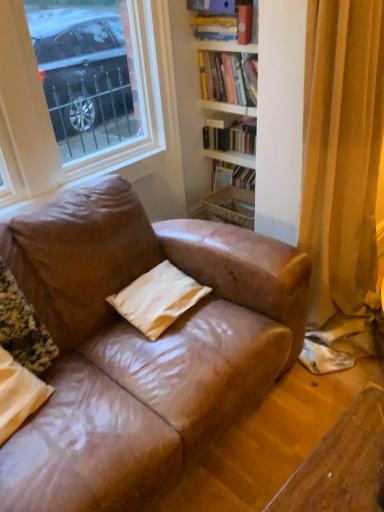
You are a GUI agent. You are given a task and a screenshot of the screen. Output one action in this format:
    pyautogui.click(x=<x>, y=<y>)
    Task: Click on the matte hardcover book at upper right, which appears as the 1th book when viewed from the top
    Image resolution: width=384 pixels, height=512 pixels.
    Given the screenshot: What is the action you would take?
    pyautogui.click(x=223, y=20)

Measure the distance between white matte pillow at center, the first pillow from the right, and camera.

white matte pillow at center, the first pillow from the right, is 1.57 meters from camera.

Where is `matte beige pillow at lower left, the first pillow when ordered from left to right`? The height and width of the screenshot is (512, 384). matte beige pillow at lower left, the first pillow when ordered from left to right is located at coordinates (23, 327).

Between point (247, 97) and point (14, 352), which one is positioned in front?

The point (14, 352) is closer.

Identify the location of the 1st pillow located beneath the hardcover books at upper center, placed as the 2th book when sorted from top to bottom (from a real-world perspective). The height and width of the screenshot is (512, 384). (23, 327).

How different are the orientations of hardcover books at upper center, placed as the 2th book when sorted from top to bottom, and matte beige pillow at lower left, the second pillow from the right, in degrees?

The angle between the facing direction of hardcover books at upper center, placed as the 2th book when sorted from top to bottom, and the facing direction of matte beige pillow at lower left, the second pillow from the right, is 89.6 degrees.

Is hardcover books at upper center, positioned as the 2th book in bottom-to-top order, bigger than matte beige pillow at lower left, the first pillow when ordered from left to right?

Incorrect, hardcover books at upper center, positioned as the 2th book in bottom-to-top order, is not larger than matte beige pillow at lower left, the first pillow when ordered from left to right.

Is matte beige pillow at lower left, the first pillow when ordered from left to right, thinner than hardcover books at upper center, placed as the 2th book when sorted from top to bottom?

No.

Considering the relative positions of matte beige pillow at lower left, the second pillow from the right, and hardcover books at upper center, positioned as the 2th book in bottom-to-top order, in the image provided, is matte beige pillow at lower left, the second pillow from the right, to the right of hardcover books at upper center, positioned as the 2th book in bottom-to-top order, from the viewer's perspective?

In fact, matte beige pillow at lower left, the second pillow from the right, is to the left of hardcover books at upper center, positioned as the 2th book in bottom-to-top order.

Which is behind, point (2, 326) or point (243, 81)?

Positioned behind is point (243, 81).

From the image's perspective, between matte beige pillow at lower left, the second pillow from the right, and hardcover books at upper center, positioned as the 2th book in bottom-to-top order, which one is located above?

hardcover books at upper center, positioned as the 2th book in bottom-to-top order, is shown above in the image.

Between hardcover books at upper center, positioned as the 2th book in bottom-to-top order, and matte hardcover book at upper right, the third book positioned from the bottom, which one is positioned behind?

hardcover books at upper center, positioned as the 2th book in bottom-to-top order, is more distant.

Considering the sizes of hardcover books at upper center, positioned as the 2th book in bottom-to-top order, and matte hardcover book at upper right, the third book positioned from the bottom, in the image, is hardcover books at upper center, positioned as the 2th book in bottom-to-top order, bigger or smaller than matte hardcover book at upper right, the third book positioned from the bottom,?

In the image, hardcover books at upper center, positioned as the 2th book in bottom-to-top order, appears to be larger than matte hardcover book at upper right, the third book positioned from the bottom.

Is hardcover books at upper center, placed as the 2th book when sorted from top to bottom, wider or thinner than matte hardcover book at upper right, which appears as the 1th book when viewed from the top?

hardcover books at upper center, placed as the 2th book when sorted from top to bottom, is thinner than matte hardcover book at upper right, which appears as the 1th book when viewed from the top.

Could you measure the distance between hardcover books at upper center, placed as the 2th book when sorted from top to bottom, and matte hardcover book at upper right, which appears as the 1th book when viewed from the top?

A distance of 6.89 inches exists between hardcover books at upper center, placed as the 2th book when sorted from top to bottom, and matte hardcover book at upper right, which appears as the 1th book when viewed from the top.

What's the angular difference between hardcover books at upper center, placed as the 2th book when sorted from top to bottom, and white matte bookshelf at upper center, acting as the 3th book starting from the top,'s facing directions?

hardcover books at upper center, placed as the 2th book when sorted from top to bottom, and white matte bookshelf at upper center, acting as the 3th book starting from the top, are facing 0.314 degrees away from each other.

Consider the image. From a real-world perspective, which object stands above the other?

hardcover books at upper center, placed as the 2th book when sorted from top to bottom.

From the picture: Is hardcover books at upper center, positioned as the 2th book in bottom-to-top order, in front of or behind white matte bookshelf at upper center, acting as the 3th book starting from the top, in the image?

Visually, hardcover books at upper center, positioned as the 2th book in bottom-to-top order, is located in front of white matte bookshelf at upper center, acting as the 3th book starting from the top.

Is hardcover books at upper center, positioned as the 2th book in bottom-to-top order, touching white matte bookshelf at upper center, which is counted as the first book, starting from the bottom?

No, hardcover books at upper center, positioned as the 2th book in bottom-to-top order, is not next to white matte bookshelf at upper center, which is counted as the first book, starting from the bottom.

Consider the image. Does white matte pillow at center, the 2th pillow from the left, lie behind matte hardcover book at upper right, the third book positioned from the bottom?

No.

From a real-world perspective, who is located higher, white matte pillow at center, the 2th pillow from the left, or matte hardcover book at upper right, which appears as the 1th book when viewed from the top?

matte hardcover book at upper right, which appears as the 1th book when viewed from the top, is physically above.

Which of these two, white matte pillow at center, the first pillow from the right, or matte hardcover book at upper right, which appears as the 1th book when viewed from the top, is bigger?

matte hardcover book at upper right, which appears as the 1th book when viewed from the top, is bigger.

Considering the relative sizes of matte hardcover book at upper right, which appears as the 1th book when viewed from the top, and matte beige pillow at lower left, the second pillow from the right, in the image provided, is matte hardcover book at upper right, which appears as the 1th book when viewed from the top, taller than matte beige pillow at lower left, the second pillow from the right,?

In fact, matte hardcover book at upper right, which appears as the 1th book when viewed from the top, may be shorter than matte beige pillow at lower left, the second pillow from the right.

How distant is matte hardcover book at upper right, the third book positioned from the bottom, from matte beige pillow at lower left, the first pillow when ordered from left to right?

A distance of 5.47 feet exists between matte hardcover book at upper right, the third book positioned from the bottom, and matte beige pillow at lower left, the first pillow when ordered from left to right.

From a real-world perspective, is matte hardcover book at upper right, the third book positioned from the bottom, positioned over matte beige pillow at lower left, the second pillow from the right, based on gravity?

Correct, in the physical world, matte hardcover book at upper right, the third book positioned from the bottom, is higher than matte beige pillow at lower left, the second pillow from the right.

Considering the relative positions of matte hardcover book at upper right, the third book positioned from the bottom, and matte beige pillow at lower left, the first pillow when ordered from left to right, in the image provided, is matte hardcover book at upper right, the third book positioned from the bottom, in front of matte beige pillow at lower left, the first pillow when ordered from left to right,?

No, it is not.

Between point (246, 121) and point (180, 310), which one is positioned behind?

The point (246, 121) is behind.

The image size is (384, 512). I want to click on the 1st pillow in front when counting from the white matte bookshelf at upper center, acting as the 3th book starting from the top, so click(x=157, y=298).

Is white matte bookshelf at upper center, which is counted as the first book, starting from the bottom, touching white matte pillow at center, the 2th pillow from the left?

There is a gap between white matte bookshelf at upper center, which is counted as the first book, starting from the bottom, and white matte pillow at center, the 2th pillow from the left.

From the image's perspective, between white matte bookshelf at upper center, acting as the 3th book starting from the top, and white matte pillow at center, the first pillow from the right, which one is located above?

white matte bookshelf at upper center, acting as the 3th book starting from the top.

This screenshot has height=512, width=384. Identify the location of book that is the 2nd one when counting upward from the matte beige pillow at lower left, the first pillow when ordered from left to right (from the image's perspective). (228, 77).

Starting from the hardcover books at upper center, positioned as the 2th book in bottom-to-top order, which pillow is the 2nd one to the left? Please provide its 2D coordinates.

[(23, 327)]

Considering their positions, is white matte bookshelf at upper center, acting as the 3th book starting from the top, positioned further to matte hardcover book at upper right, which appears as the 1th book when viewed from the top, than hardcover books at upper center, positioned as the 2th book in bottom-to-top order?

Among the two, white matte bookshelf at upper center, acting as the 3th book starting from the top, is located further to matte hardcover book at upper right, which appears as the 1th book when viewed from the top.

From the image, which object appears to be nearer to white matte pillow at center, the 2th pillow from the left, matte hardcover book at upper right, which appears as the 1th book when viewed from the top, or hardcover books at upper center, positioned as the 2th book in bottom-to-top order?

Among the two, hardcover books at upper center, positioned as the 2th book in bottom-to-top order, is located nearer to white matte pillow at center, the 2th pillow from the left.

Looking at the image, which one is located further to white matte bookshelf at upper center, which is counted as the first book, starting from the bottom, matte hardcover book at upper right, the third book positioned from the bottom, or white matte pillow at center, the 2th pillow from the left?

white matte pillow at center, the 2th pillow from the left.

Looking at the image, which one is located closer to hardcover books at upper center, placed as the 2th book when sorted from top to bottom, matte beige pillow at lower left, the first pillow when ordered from left to right, or white matte bookshelf at upper center, acting as the 3th book starting from the top?

The object closer to hardcover books at upper center, placed as the 2th book when sorted from top to bottom, is white matte bookshelf at upper center, acting as the 3th book starting from the top.

Estimate the real-world distances between objects in this image. Which object is further from matte beige pillow at lower left, the second pillow from the right, white matte pillow at center, the 2th pillow from the left, or white matte bookshelf at upper center, which is counted as the first book, starting from the bottom?

Among the two, white matte bookshelf at upper center, which is counted as the first book, starting from the bottom, is located further to matte beige pillow at lower left, the second pillow from the right.

Estimate the real-world distances between objects in this image. Which object is closer to matte beige pillow at lower left, the first pillow when ordered from left to right, white matte pillow at center, the first pillow from the right, or matte hardcover book at upper right, the third book positioned from the bottom?

The object closer to matte beige pillow at lower left, the first pillow when ordered from left to right, is white matte pillow at center, the first pillow from the right.

Considering their positions, is white matte pillow at center, the first pillow from the right, positioned closer to hardcover books at upper center, positioned as the 2th book in bottom-to-top order, than matte beige pillow at lower left, the first pillow when ordered from left to right?

white matte pillow at center, the first pillow from the right.

Considering their positions, is matte beige pillow at lower left, the second pillow from the right, positioned further to white matte pillow at center, the first pillow from the right, than matte hardcover book at upper right, which appears as the 1th book when viewed from the top?

Based on the image, matte hardcover book at upper right, which appears as the 1th book when viewed from the top, appears to be further to white matte pillow at center, the first pillow from the right.

Locate an element on the screen. The image size is (384, 512). book between hardcover books at upper center, placed as the 2th book when sorted from top to bottom, and white matte pillow at center, the 2th pillow from the left, vertically is located at coordinates (232, 137).

Identify the location of pillow between matte hardcover book at upper right, which appears as the 1th book when viewed from the top, and matte beige pillow at lower left, the first pillow when ordered from left to right, in the vertical direction. Image resolution: width=384 pixels, height=512 pixels. (157, 298).

You are a GUI agent. You are given a task and a screenshot of the screen. Output one action in this format:
    pyautogui.click(x=<x>, y=<y>)
    Task: Click on the pillow between hardcover books at upper center, placed as the 2th book when sorted from top to bottom, and matte beige pillow at lower left, the first pillow when ordered from left to right, vertically
    
    Given the screenshot: What is the action you would take?
    pyautogui.click(x=157, y=298)

What are the coordinates of `pillow between matte beige pillow at lower left, the second pillow from the right, and white matte bookshelf at upper center, acting as the 3th book starting from the top, along the z-axis` in the screenshot? It's located at (157, 298).